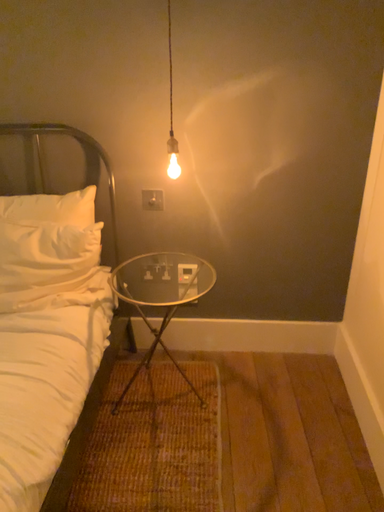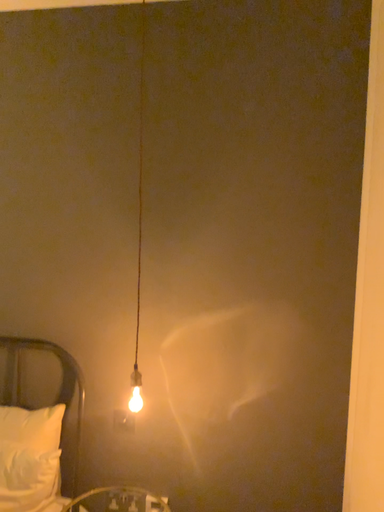
Question: Which way did the camera rotate in the video?

Choices:
 (A) rotated upward
 (B) rotated downward

Answer: (A)